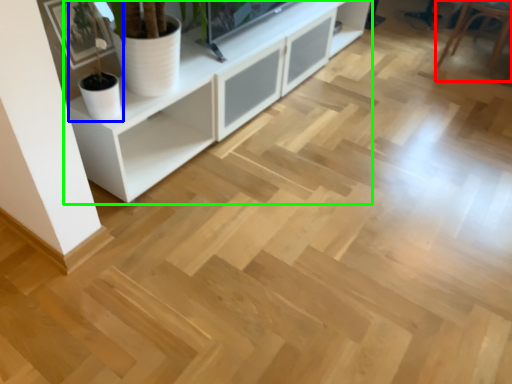
Question: Estimate the real-world distances between objects in this image. Which object is closer to armchair (highlighted by a red box), houseplant (highlighted by a blue box) or cabinetry (highlighted by a green box)?

Choices:
 (A) houseplant
 (B) cabinetry

Answer: (B)